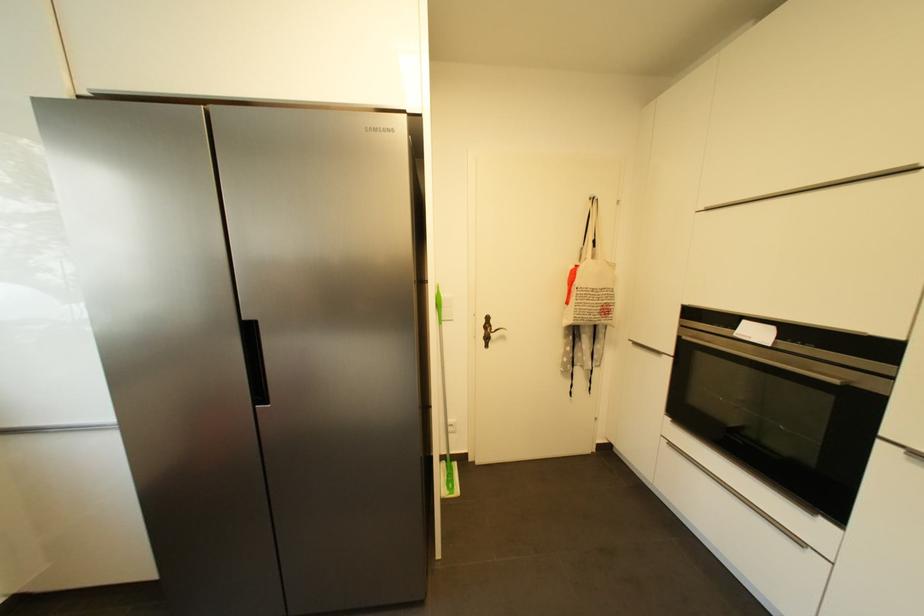
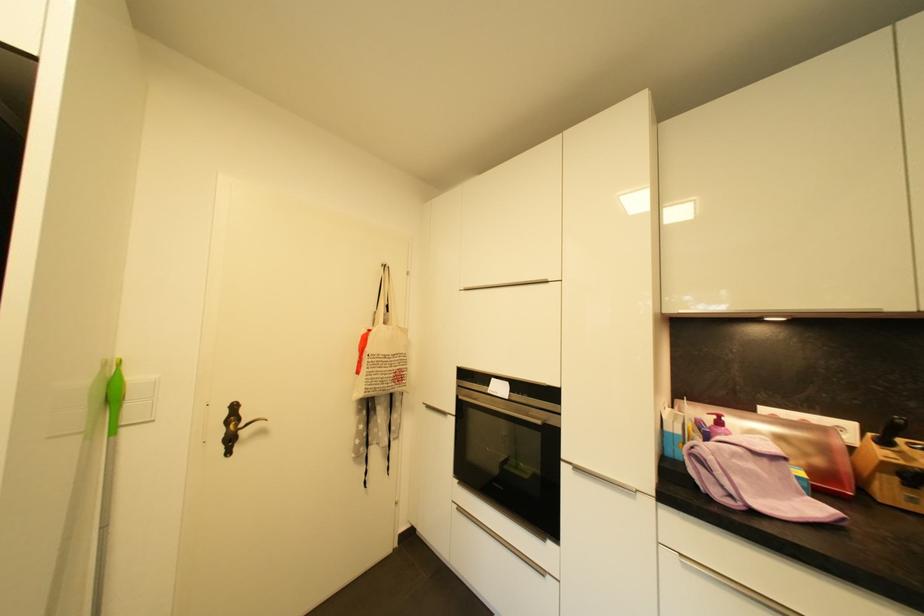
The point at (487, 334) is marked in the first image. Where is the corresponding point in the second image?

(225, 434)